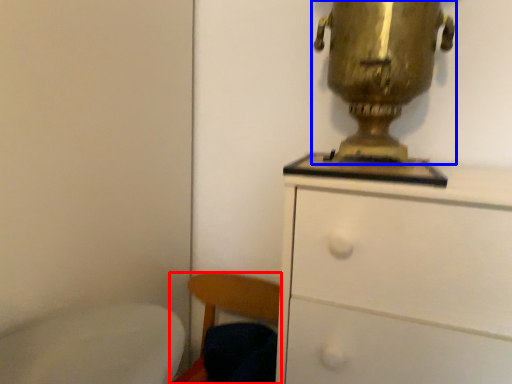
Question: Which object appears closest to the camera in this image, chair (highlighted by a red box) or table lamp (highlighted by a blue box)?

Choices:
 (A) chair
 (B) table lamp

Answer: (B)